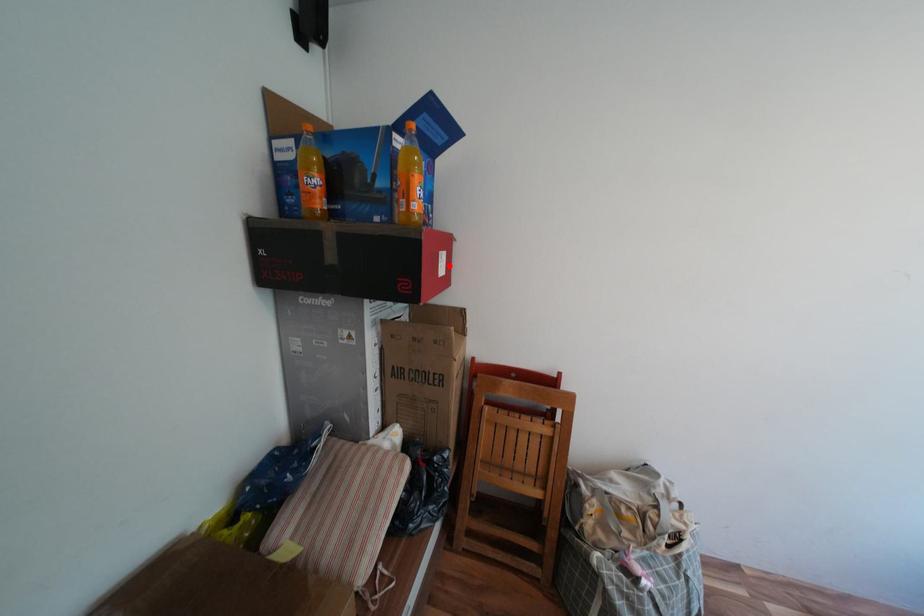
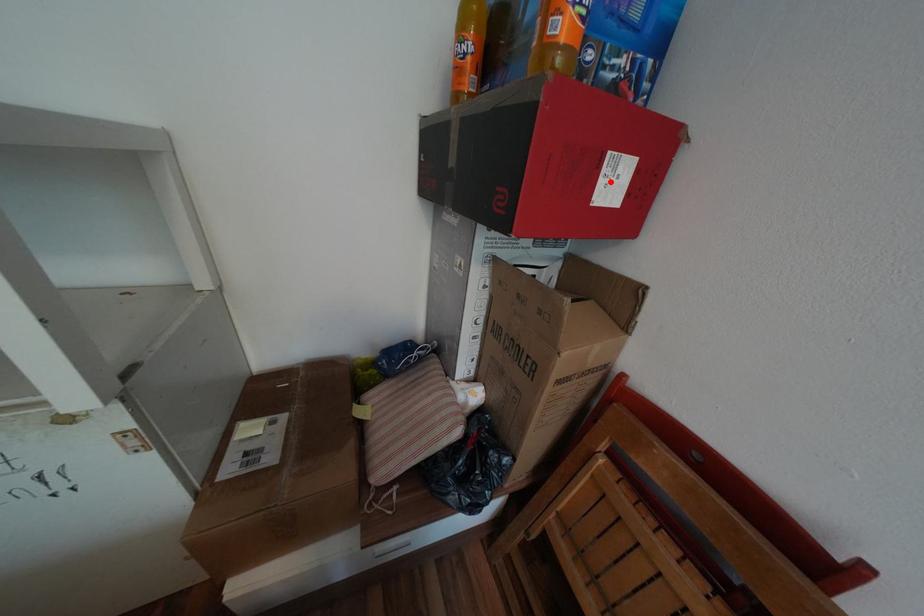
I am providing you with two images of the same scene from different viewpoints. A red point is marked on the first image and another point is marked on the second image. Does the point marked in image1 correspond to the same location as the one in image2?

Yes